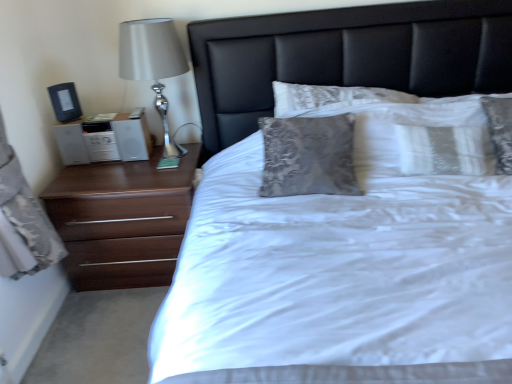
Question: From a real-world perspective, is brown wood chest of drawers at left positioned above or below white satin bed at center?

Choices:
 (A) below
 (B) above

Answer: (A)

Question: From their relative heights in the image, would you say brown wood chest of drawers at left is taller or shorter than white satin bed at center?

Choices:
 (A) tall
 (B) short

Answer: (B)

Question: Based on their relative distances, which object is nearer to the white satin bed at center?

Choices:
 (A) white textured pillow at upper right
 (B) white glossy nightstand at left
 (C) brown wood chest of drawers at left
 (D) black leather headboard at center
 (E) silver metallic table lamp at left

Answer: (A)

Question: Estimate the real-world distances between objects in this image. Which object is closer to the brown wood chest of drawers at left?

Choices:
 (A) white textured pillow at upper right
 (B) white glossy nightstand at left
 (C) silver metallic table lamp at left
 (D) white satin bed at center
 (E) black leather headboard at center

Answer: (B)